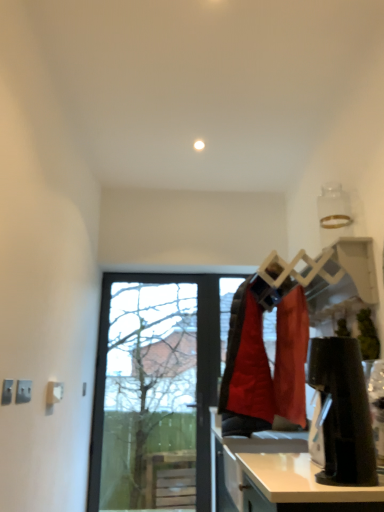
Question: Based on their positions, is transparent glass door at center located to the left or right of light brown laminate counter top at lower right?

Choices:
 (A) right
 (B) left

Answer: (B)

Question: From a real-world perspective, is transparent glass door at center positioned above or below light brown laminate counter top at lower right?

Choices:
 (A) above
 (B) below

Answer: (A)

Question: In terms of height, does transparent glass door at center look taller or shorter compared to light brown laminate counter top at lower right?

Choices:
 (A) short
 (B) tall

Answer: (B)

Question: Is light brown laminate counter top at lower right wider or thinner than transparent glass door at center?

Choices:
 (A) thin
 (B) wide

Answer: (B)

Question: Does point (289, 458) appear closer or farther from the camera than point (109, 415)?

Choices:
 (A) farther
 (B) closer

Answer: (B)

Question: Based on their sizes in the image, would you say light brown laminate counter top at lower right is bigger or smaller than transparent glass door at center?

Choices:
 (A) big
 (B) small

Answer: (B)

Question: In the image, is light brown laminate counter top at lower right positioned in front of or behind transparent glass door at center?

Choices:
 (A) front
 (B) behind

Answer: (A)